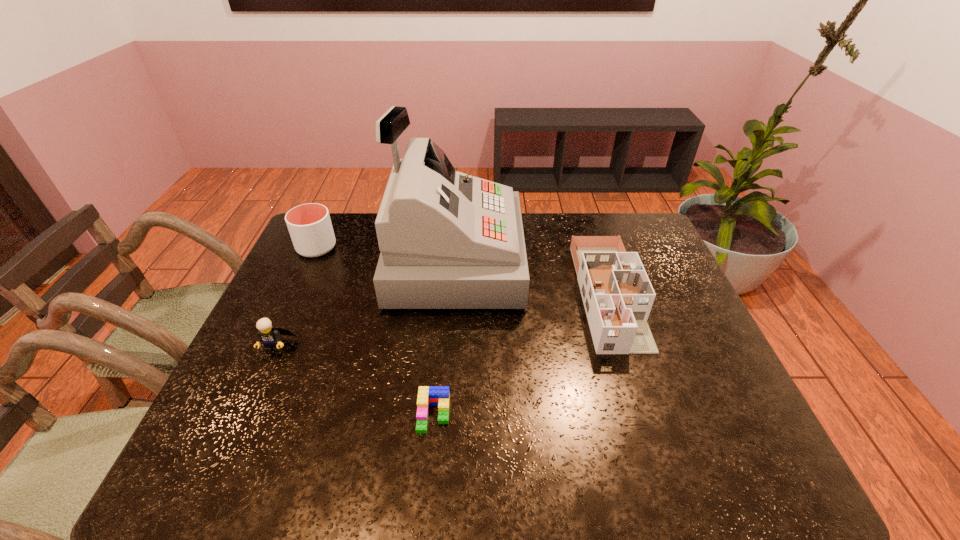
The height and width of the screenshot is (540, 960). Find the location of `vacant space that is in between the rightmost object and the left Lego`. vacant space that is in between the rightmost object and the left Lego is located at coordinates (442, 320).

The width and height of the screenshot is (960, 540). In order to click on free spot between the left Lego and the shorter Lego in this screenshot , I will do `click(354, 380)`.

I want to click on empty space between the nearest object and the cup, so click(x=375, y=331).

I want to click on free space between the fourth shortest object and the farther Lego, so click(x=296, y=296).

This screenshot has height=540, width=960. I want to click on object that can be found as the second closest to the cash register, so click(310, 227).

Identify which object is located as the second nearest to the cash register. Please provide its 2D coordinates. Your answer should be formatted as a tuple, i.e. [(x, y)], where the tuple contains the x and y coordinates of a point satisfying the conditions above.

[(310, 227)]

This screenshot has width=960, height=540. Find the location of `blank area in the image that satisfies the following two spatial constraints: 1. on the front-facing side of the left Lego; 2. on the right side of the right Lego`. blank area in the image that satisfies the following two spatial constraints: 1. on the front-facing side of the left Lego; 2. on the right side of the right Lego is located at coordinates (244, 415).

At what (x,y) coordinates should I click in order to perform the action: click on free space in the image that satisfies the following two spatial constraints: 1. on the keypad side of the cash register; 2. on the front-facing side of the taller Lego. Please return your answer as a coordinate pair (x, y). Looking at the image, I should click on (447, 346).

Identify the location of free space that satisfies the following two spatial constraints: 1. on the keypad side of the tallest object; 2. on the front-facing side of the left Lego. This screenshot has width=960, height=540. (447, 346).